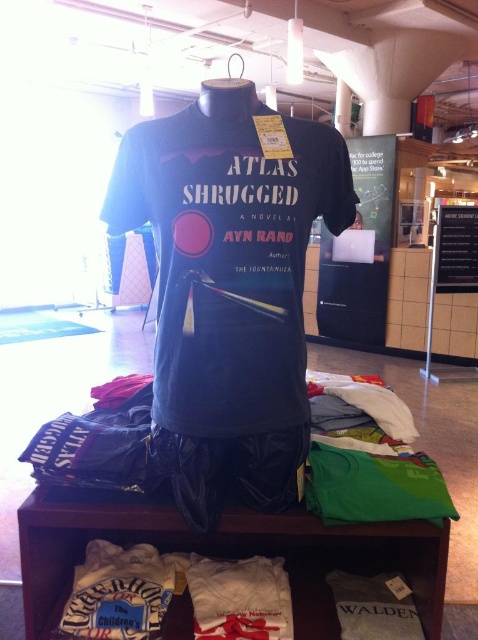
Question: Where is dark blue cotton t-shirt at center located in relation to white cotton t-shirt at lower center in the image?

Choices:
 (A) below
 (B) above

Answer: (B)

Question: Does dark blue cotton t-shirt at center have a greater width compared to white cotton t-shirt at lower center?

Choices:
 (A) no
 (B) yes

Answer: (A)

Question: Which point is farther from the camera taking this photo?

Choices:
 (A) (234, 401)
 (B) (404, 556)

Answer: (B)

Question: Is the position of dark blue cotton t-shirt at center more distant than that of white cotton t-shirt at lower center?

Choices:
 (A) no
 (B) yes

Answer: (A)

Question: Which point appears closest to the camera in this image?

Choices:
 (A) (332, 636)
 (B) (165, 176)

Answer: (B)

Question: Which point is closer to the camera?

Choices:
 (A) (22, 561)
 (B) (306, 160)

Answer: (B)